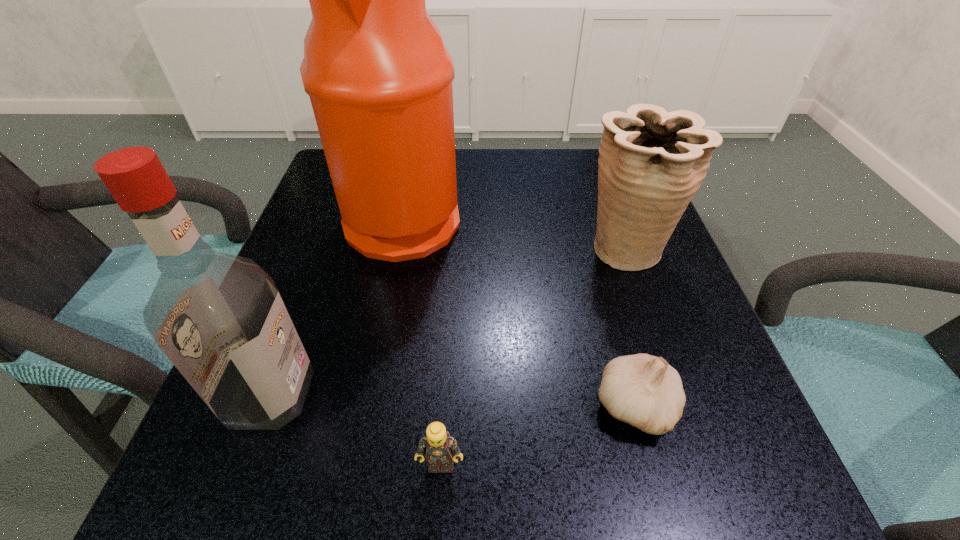
Locate an element on the screen. Image resolution: width=960 pixels, height=540 pixels. garlic positioned at the near edge is located at coordinates (642, 390).

Image resolution: width=960 pixels, height=540 pixels. What are the coordinates of `Lego that is positioned at the near edge` in the screenshot? It's located at (441, 449).

Where is `water jug that is at the left edge`? water jug that is at the left edge is located at coordinates (379, 78).

Locate an element on the screen. This screenshot has width=960, height=540. liquor that is at the left edge is located at coordinates (219, 318).

Locate an element on the screen. urn at the right edge is located at coordinates (651, 162).

Locate an element on the screen. garlic that is at the right edge is located at coordinates (642, 390).

This screenshot has width=960, height=540. I want to click on object located in the far left corner section of the desktop, so click(x=379, y=78).

I want to click on object positioned at the near right corner, so click(642, 390).

In the image, there is a desktop. At what (x,y) coordinates should I click in order to perform the action: click on free space at the far edge. Please return your answer as a coordinate pair (x, y). The height and width of the screenshot is (540, 960). Looking at the image, I should click on (546, 205).

Locate an element on the screen. vacant space at the near edge of the desktop is located at coordinates (354, 446).